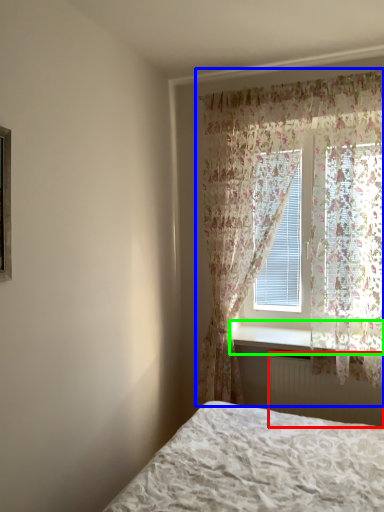
Question: Considering the real-world distances, which object is farthest from radiator (highlighted by a red box)? curtain (highlighted by a blue box) or window sill (highlighted by a green box)?

Choices:
 (A) curtain
 (B) window sill

Answer: (A)